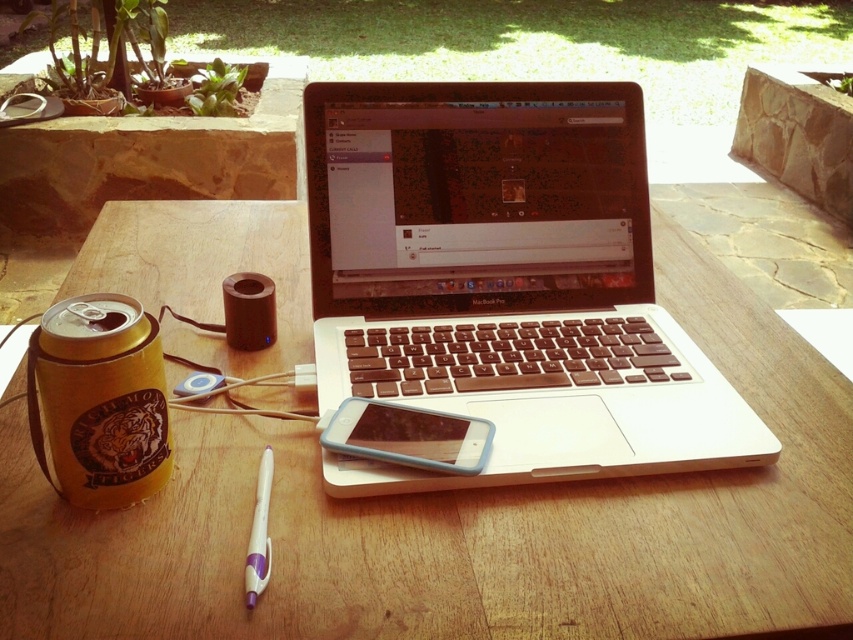
Question: Does wooden table at center have a smaller size compared to white plastic laptop at center?

Choices:
 (A) no
 (B) yes

Answer: (A)

Question: Which of the following is the closest to the observer?

Choices:
 (A) (264, 497)
 (B) (132, 460)
 (C) (648, 330)
 (D) (431, 429)

Answer: (B)

Question: Considering the real-world distances, which object is closest to the translucent plastic phone at center?

Choices:
 (A) gold leather can at left
 (B) wooden table at center

Answer: (A)

Question: Considering the real-world distances, which object is farthest from the translucent plastic phone at center?

Choices:
 (A) white plastic laptop at center
 (B) white plastic pen at lower center
 (C) wooden table at center
 (D) gold leather can at left

Answer: (C)

Question: Is white plastic laptop at center smaller than translucent plastic phone at center?

Choices:
 (A) yes
 (B) no

Answer: (B)

Question: Does wooden table at center lie behind translucent plastic phone at center?

Choices:
 (A) no
 (B) yes

Answer: (A)